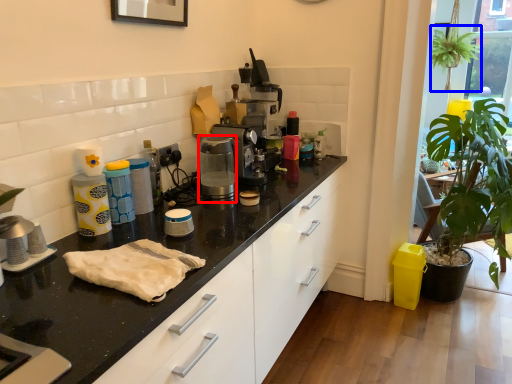
Question: Which object appears farthest to the camera in this image, coffee machine (highlighted by a red box) or plant (highlighted by a blue box)?

Choices:
 (A) coffee machine
 (B) plant

Answer: (B)